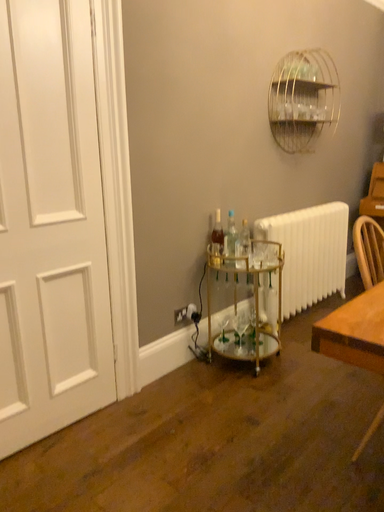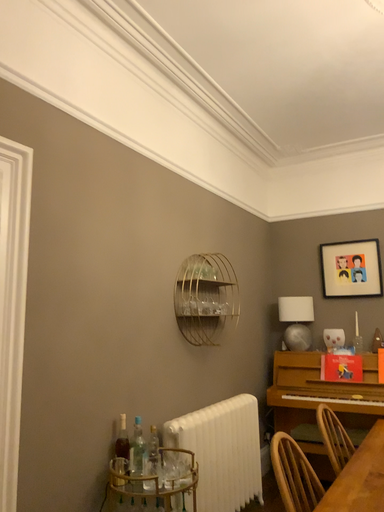
Question: How did the camera likely rotate when shooting the video?

Choices:
 (A) rotated downward
 (B) rotated upward

Answer: (B)